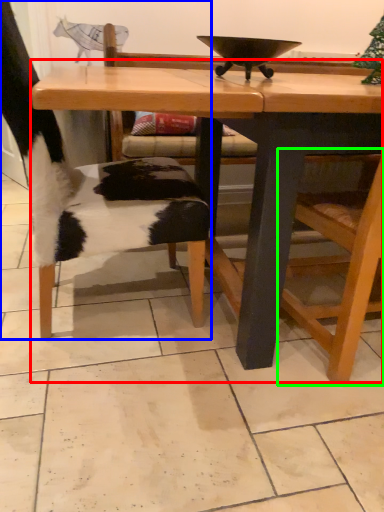
Question: Considering the real-world distances, which object is farthest from table (highlighted by a red box)? chair (highlighted by a blue box) or armchair (highlighted by a green box)?

Choices:
 (A) chair
 (B) armchair

Answer: (A)